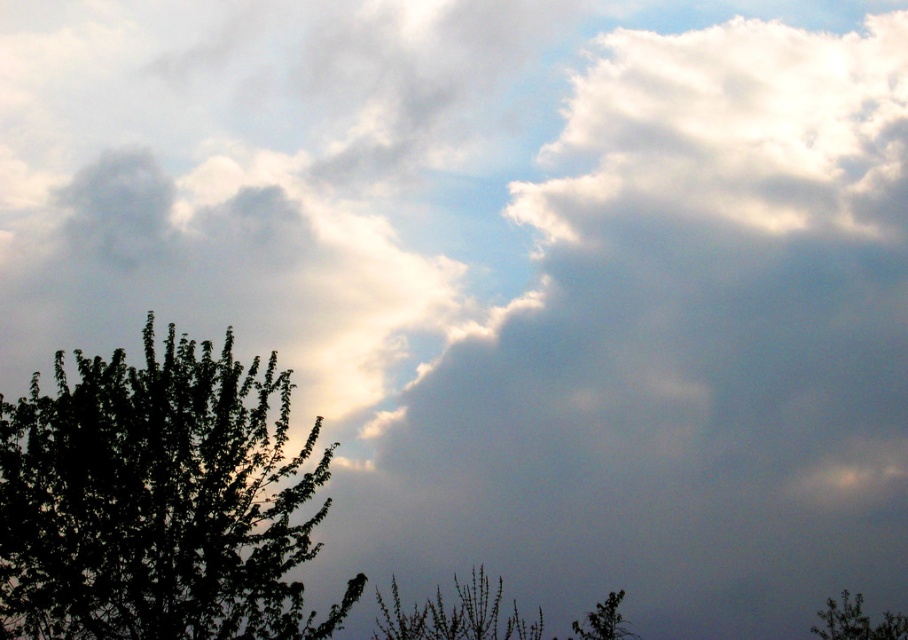
You are an artist painting the scene and want to ensure the trees are proportionally accurate. Which tree should you draw first to maintain the correct size relationship between the green matte tree at lower center and the green matte tree at lower right?

You should draw the green matte tree at lower center first because it is larger than the green matte tree at lower right, ensuring the size relationship is maintained.

You are an astronomer analyzing the sky scene. You observe two points in the image labeled as point 1 at coordinates (199, 488) and point 2 at coordinates (472, 572). Based on their positions, which point is closer to the observer?

Point 1 at coordinates (199, 488) is closer to the observer because it is in front of point 2 at coordinates (472, 572).